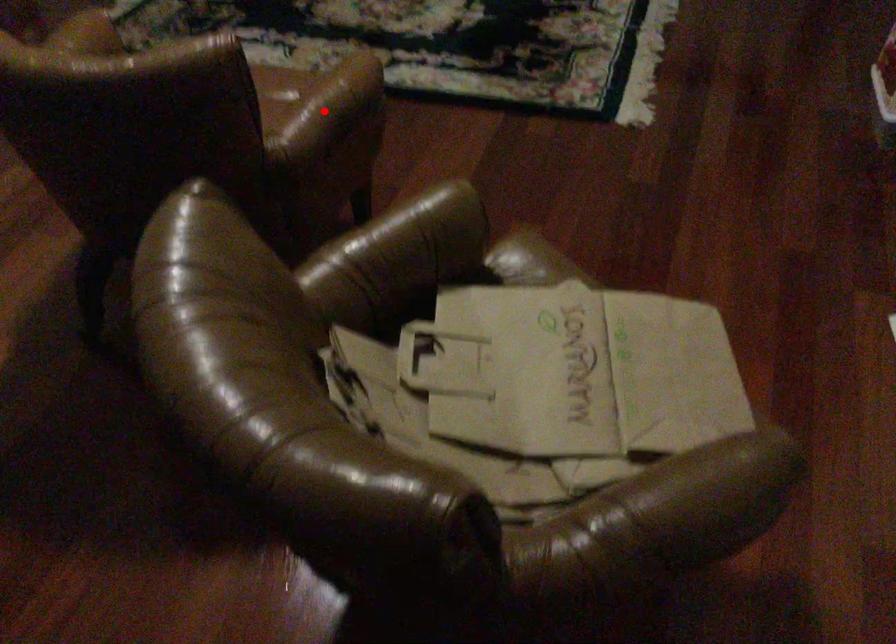
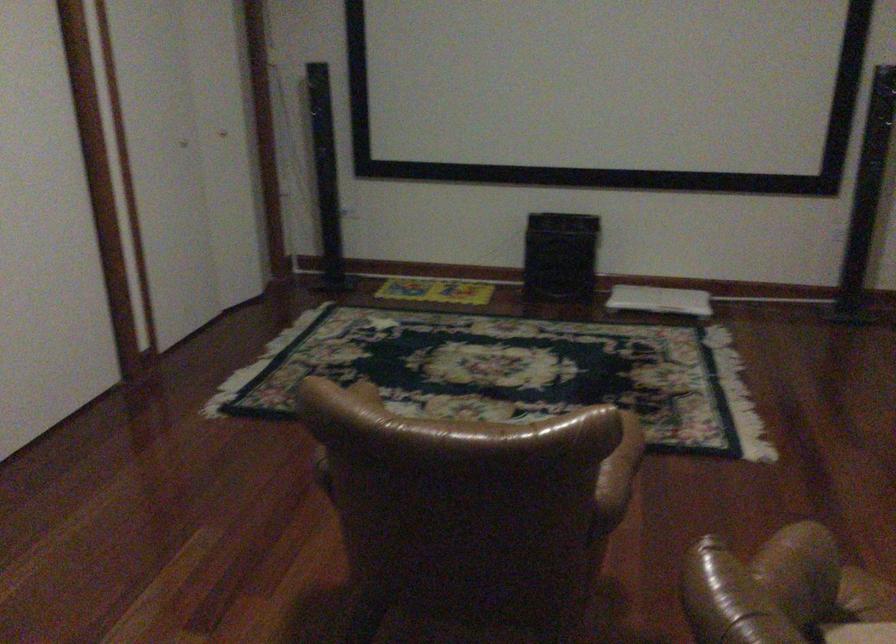
Where in the second image is the point corresponding to the highlighted location from the first image?

(622, 460)